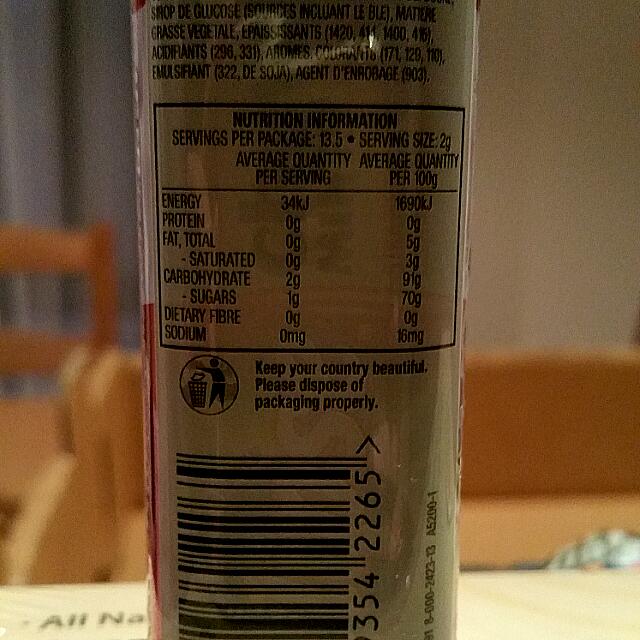
The width and height of the screenshot is (640, 640). What are the coordinates of `places to sit` in the screenshot? It's located at (532, 512), (29, 411).